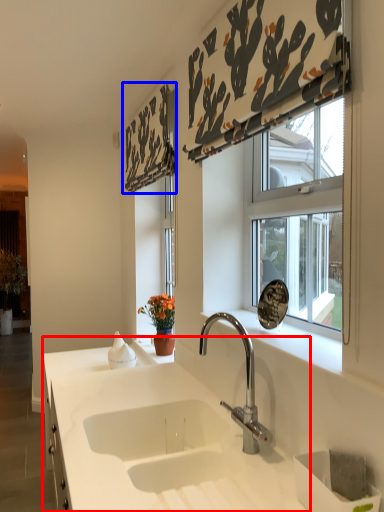
Question: Which object appears closest to the camera in this image, countertop (highlighted by a red box) or curtain (highlighted by a blue box)?

Choices:
 (A) countertop
 (B) curtain

Answer: (A)